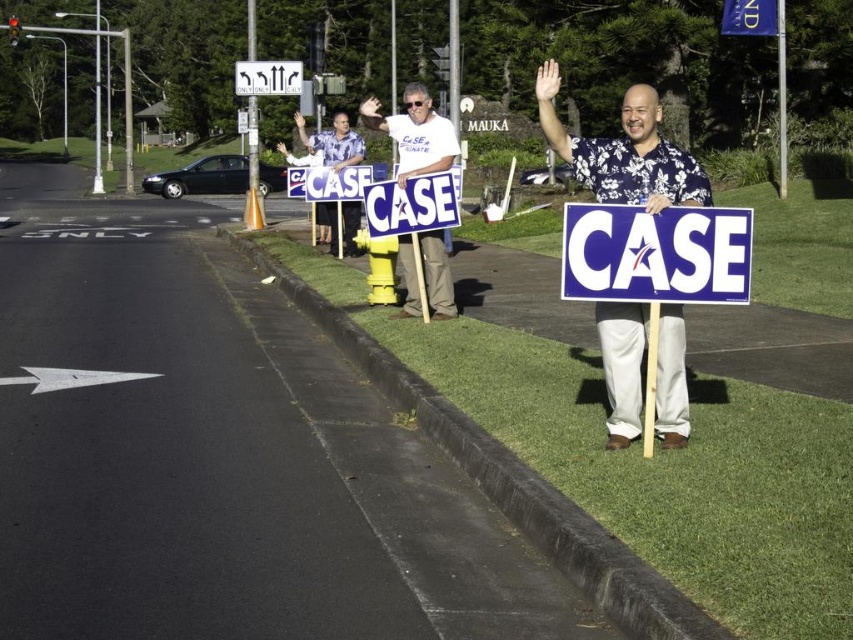
You are a photographer trying to capture a clear shot of the blue floral shirt at center and the white cotton shirt at center. Which shirt should you focus on first to ensure it appears sharp in the photo?

The blue floral shirt at center is positioned under the white cotton shirt at center, so focusing on the white cotton shirt at center first will ensure it stays sharp as it is closer to the camera.

In the scene shown: You are a photographer trying to capture a clear shot of the matte floral shirt at center and the white plastic sign at upper center. Given their sizes, which object should you zoom in on to ensure both are visible without cropping?

The matte floral shirt at center is smaller in width than the white plastic sign at upper center. To ensure both are visible without cropping, you should zoom out slightly so that the larger white plastic sign at upper center fits within the frame, allowing the smaller matte floral shirt at center to also be included.

You are a photographer taking a group photo of the individuals holding the signs. You want to ensure both the blue floral shirt at center and the white cotton shirt at center are visible in the frame. Which shirt should you focus on to include both in the photo?

The blue floral shirt at center is not as tall as the white cotton shirt at center, so focusing on the taller white cotton shirt at center would ensure both shirts are visible in the frame.